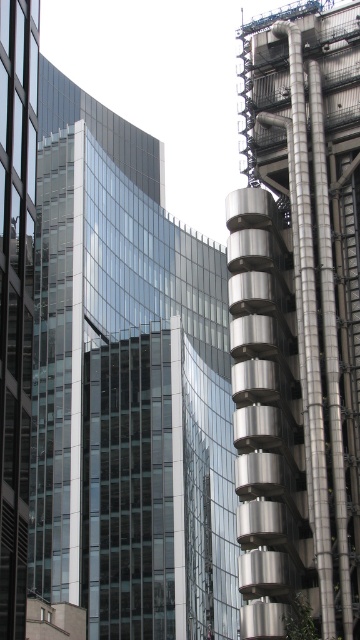
Question: Is transparent glass building at center positioned at the back of polished silver tower at right?

Choices:
 (A) no
 (B) yes

Answer: (B)

Question: Is transparent glass building at center above polished silver tower at right?

Choices:
 (A) yes
 (B) no

Answer: (B)

Question: Can you confirm if polished silver tower at right is positioned below transparent glass skyscraper at left?

Choices:
 (A) yes
 (B) no

Answer: (A)

Question: Which object appears farthest from the camera in this image?

Choices:
 (A) transparent glass skyscraper at left
 (B) transparent glass building at center
 (C) polished silver tower at right

Answer: (B)

Question: Which object is closer to the camera taking this photo?

Choices:
 (A) transparent glass building at center
 (B) polished silver tower at right
 (C) transparent glass skyscraper at left

Answer: (C)

Question: Estimate the real-world distances between objects in this image. Which object is closer to the transparent glass building at center?

Choices:
 (A) polished silver tower at right
 (B) transparent glass skyscraper at left

Answer: (A)